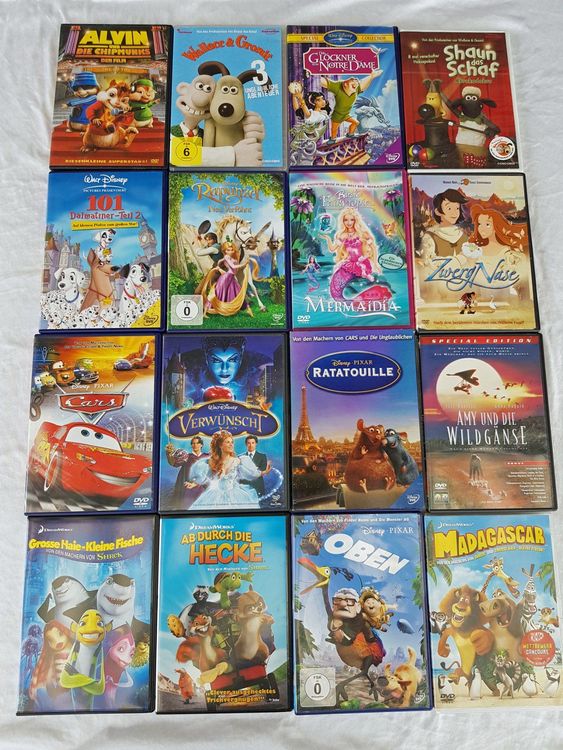
Where is `second row of dvds`? This screenshot has width=563, height=750. second row of dvds is located at coordinates (468, 280), (321, 238), (230, 253), (111, 248).